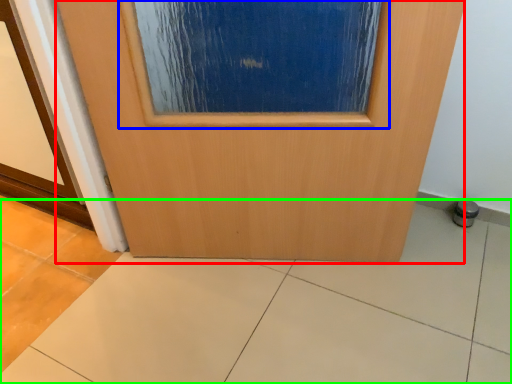
Question: Which object is the closest to the door (highlighted by a red box)? Choose among these: airplane window (highlighted by a blue box) or ceramic tile (highlighted by a green box).

Choices:
 (A) airplane window
 (B) ceramic tile

Answer: (A)